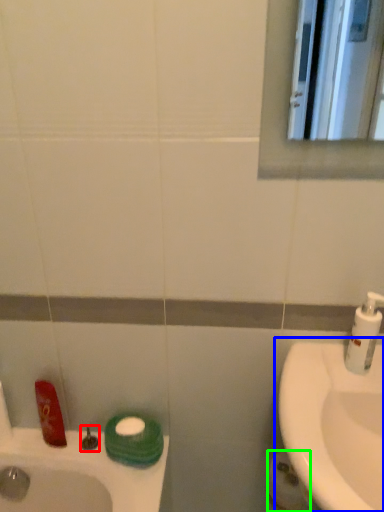
Question: Considering the real-world distances, which object is closest to plumbing fixture (highlighted by a red box)? sink (highlighted by a blue box) or toilet paper (highlighted by a green box).

Choices:
 (A) sink
 (B) toilet paper

Answer: (B)